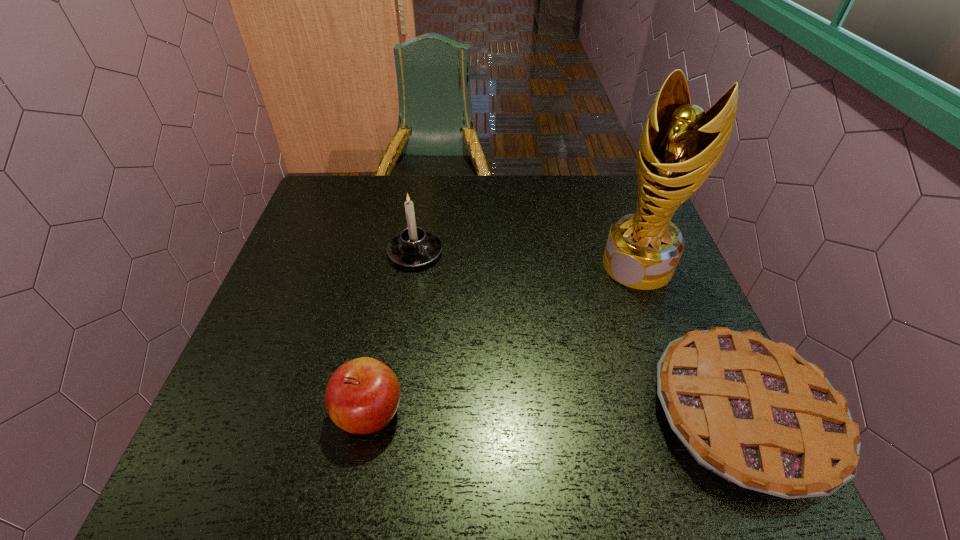
This screenshot has width=960, height=540. I want to click on vacant space that is in between the second shortest object and the third shortest object, so click(393, 333).

Locate an element on the screen. The width and height of the screenshot is (960, 540). object that can be found as the closest to the candle holder is located at coordinates (362, 396).

Locate an element on the screen. the closest object to the candle holder is located at coordinates (362, 396).

Find the location of a particular element. free space in the image that satisfies the following two spatial constraints: 1. on the front side of the pie; 2. on the right side of the tallest object is located at coordinates (693, 414).

Where is `free space that satisfies the following two spatial constraints: 1. on the front side of the third shortest object; 2. on the right side of the award`? free space that satisfies the following two spatial constraints: 1. on the front side of the third shortest object; 2. on the right side of the award is located at coordinates (414, 265).